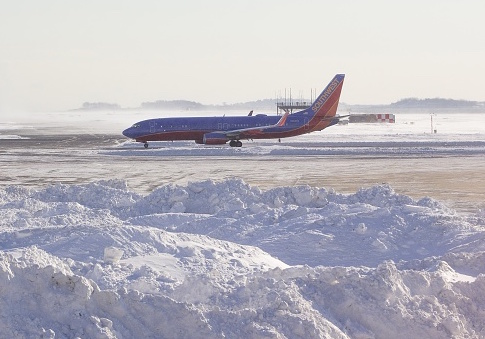
Locate an element on the screen. The height and width of the screenshot is (339, 485). windows is located at coordinates (163, 129), (168, 129), (180, 128), (230, 125), (242, 125), (259, 125).